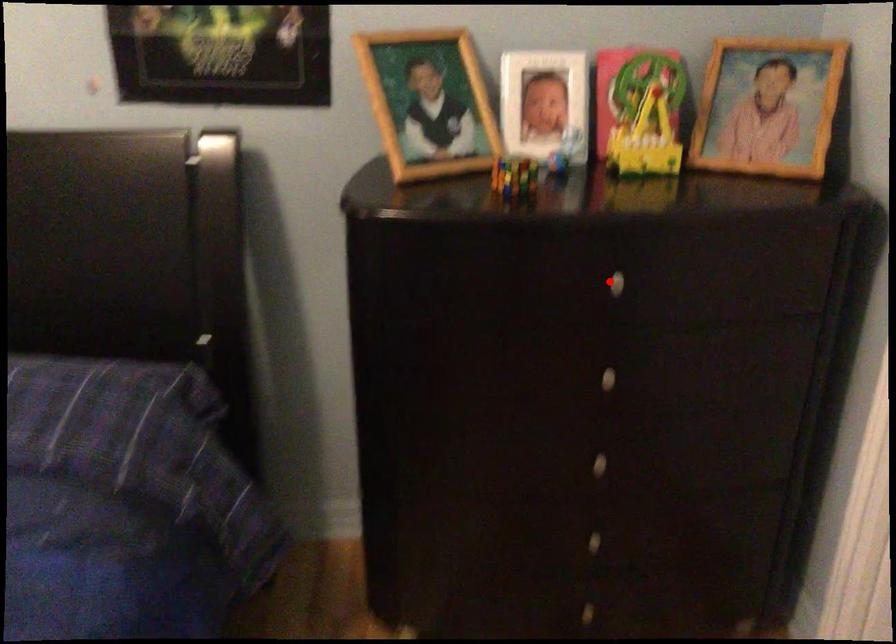
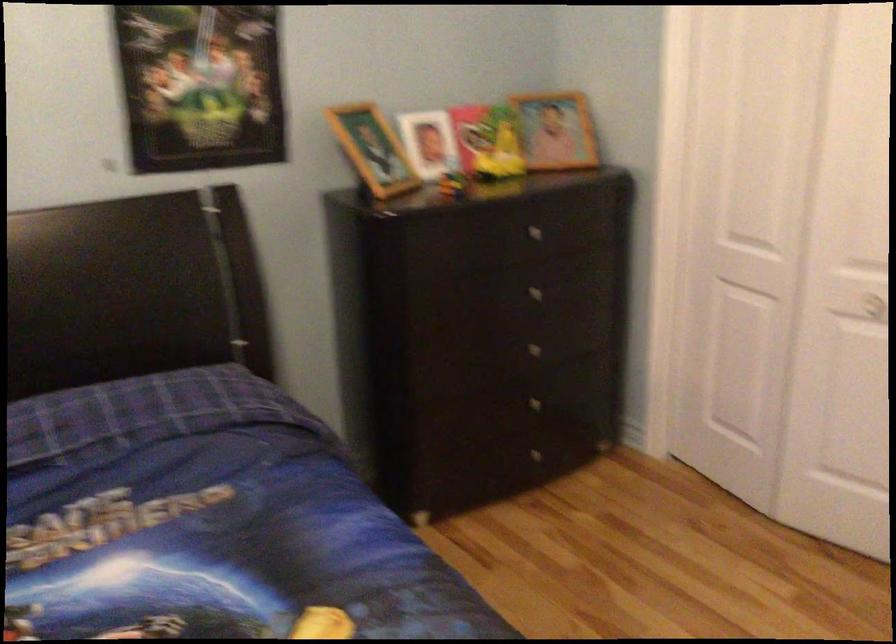
Question: I am providing you with two images of the same scene from different viewpoints. A red point is marked on the first image. Is the red point's position out of view in image 2?

Choices:
 (A) Yes
 (B) No

Answer: (B)